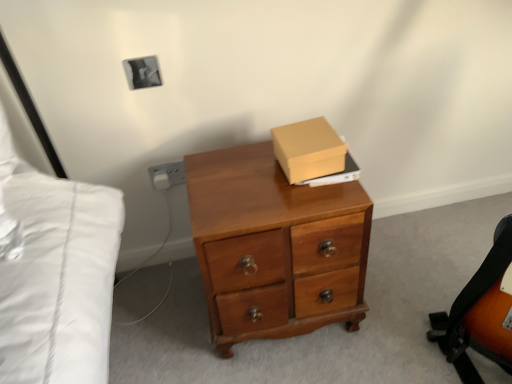
Where is `free location to the left of wooden desk at center`? This screenshot has height=384, width=512. free location to the left of wooden desk at center is located at coordinates (162, 313).